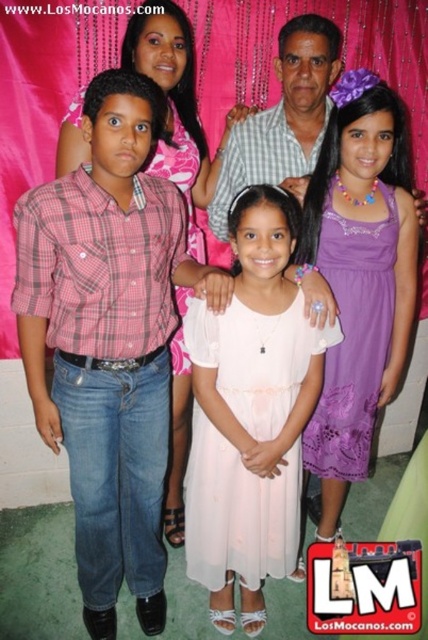
Question: Considering the real-world distances, which object is farthest from the pink sheer dress at center?

Choices:
 (A) checkered fabric shirt at center
 (B) purple lace dress at center

Answer: (A)

Question: Is pink sheer dress at center to the left of purple lace dress at center from the viewer's perspective?

Choices:
 (A) yes
 (B) no

Answer: (A)

Question: Which point appears farthest from the camera in this image?

Choices:
 (A) (246, 362)
 (B) (395, 141)

Answer: (B)

Question: From the image, what is the correct spatial relationship of purple lace dress at center in relation to checkered fabric shirt at center?

Choices:
 (A) left
 (B) right

Answer: (B)

Question: Which object appears closest to the camera in this image?

Choices:
 (A) purple lace dress at center
 (B) pink sheer dress at center

Answer: (B)

Question: Is pink sheer dress at center smaller than purple lace dress at center?

Choices:
 (A) yes
 (B) no

Answer: (A)